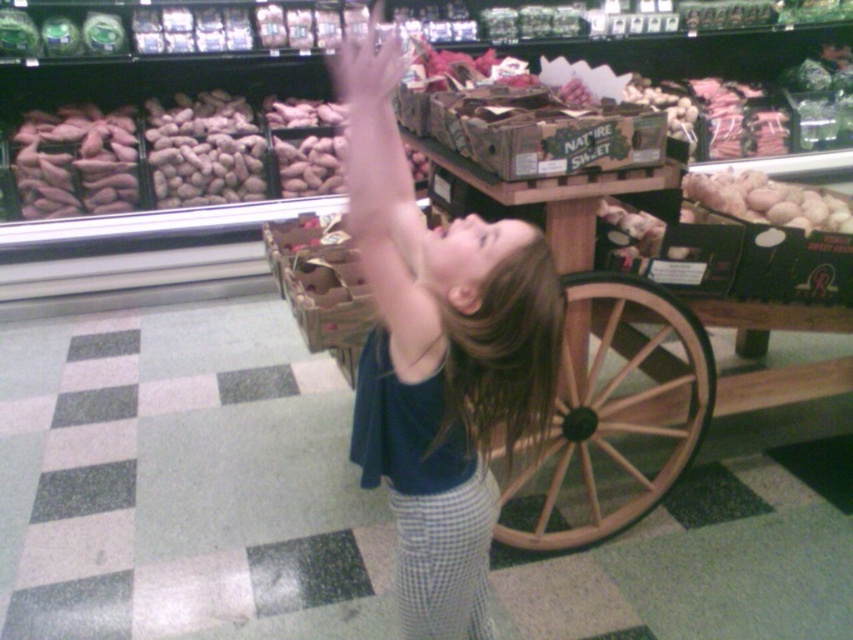
Question: Estimate the real-world distances between objects in this image. Which object is farther from the smooth brown peanuts at upper left?

Choices:
 (A) pink matte potatoes at left
 (B) smooth beige potatoes at right
 (C) blonde hair at upper center

Answer: (C)

Question: Is blonde hair at upper center positioned behind smooth skin hand at upper center?

Choices:
 (A) yes
 (B) no

Answer: (B)

Question: Does pink matte potatoes at left have a larger size compared to smooth beige potatoes at right?

Choices:
 (A) yes
 (B) no

Answer: (A)

Question: Which is nearer to the blonde hair at upper center?

Choices:
 (A) smooth skin hand at upper center
 (B) dark blue shirt at center

Answer: (B)

Question: Can you confirm if blonde hair at upper center is positioned above smooth beige potatoes at right?

Choices:
 (A) no
 (B) yes

Answer: (A)

Question: Which point is farther from the camera taking this photo?

Choices:
 (A) (212, 90)
 (B) (426, 540)

Answer: (A)